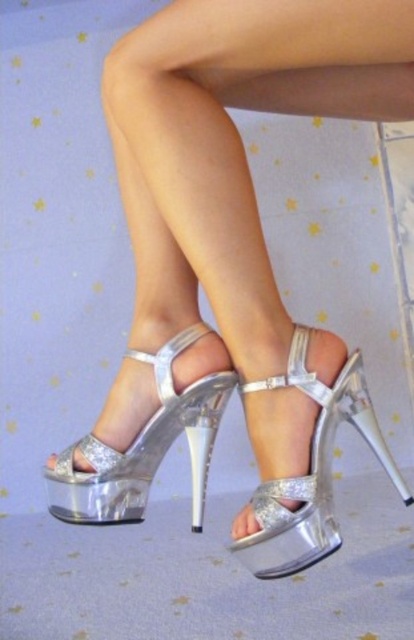
Is shiny silver sandal at center closer to the viewer compared to shiny metallic platform sandal at center?

No, it is not.

Between shiny silver sandal at center and shiny metallic platform sandal at center, which one is positioned higher?

shiny silver sandal at center is above.

Locate an element on the screen. The width and height of the screenshot is (414, 640). shiny silver sandal at center is located at coordinates (144, 445).

This screenshot has width=414, height=640. Identify the location of shiny silver sandal at center. (144, 445).